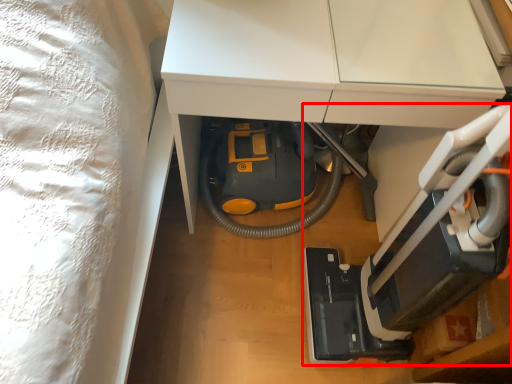
Question: From the image's perspective, where is equipment (annotated by the red box) located relative to furniture?

Choices:
 (A) below
 (B) above

Answer: (A)